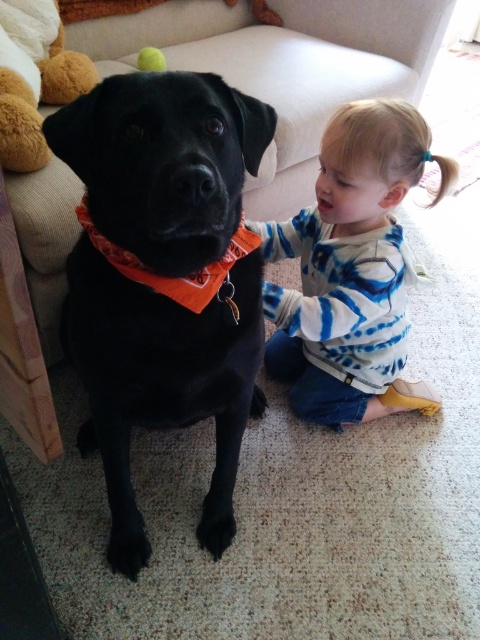
Question: Which point is closer to the camera?

Choices:
 (A) (144, 68)
 (B) (194, 141)
 (C) (354, 224)
 (D) (32, 67)

Answer: (B)

Question: Is black matte dog at center positioned behind soft plush toy at left?

Choices:
 (A) yes
 (B) no

Answer: (B)

Question: Which object is the closest to the yellow rubber ball at upper center?

Choices:
 (A) black matte dog at center
 (B) blue tie-dye shirt at lower right

Answer: (B)

Question: Among these points, which one is farthest from the camera?

Choices:
 (A) (119, 224)
 (B) (148, 58)
 (C) (1, 76)

Answer: (B)

Question: Considering the relative positions of blue tie-dye shirt at lower right and soft plush toy at left in the image provided, where is blue tie-dye shirt at lower right located with respect to soft plush toy at left?

Choices:
 (A) above
 (B) below

Answer: (B)

Question: From the image, what is the correct spatial relationship of black matte dog at center in relation to yellow rubber ball at upper center?

Choices:
 (A) left
 (B) right

Answer: (B)